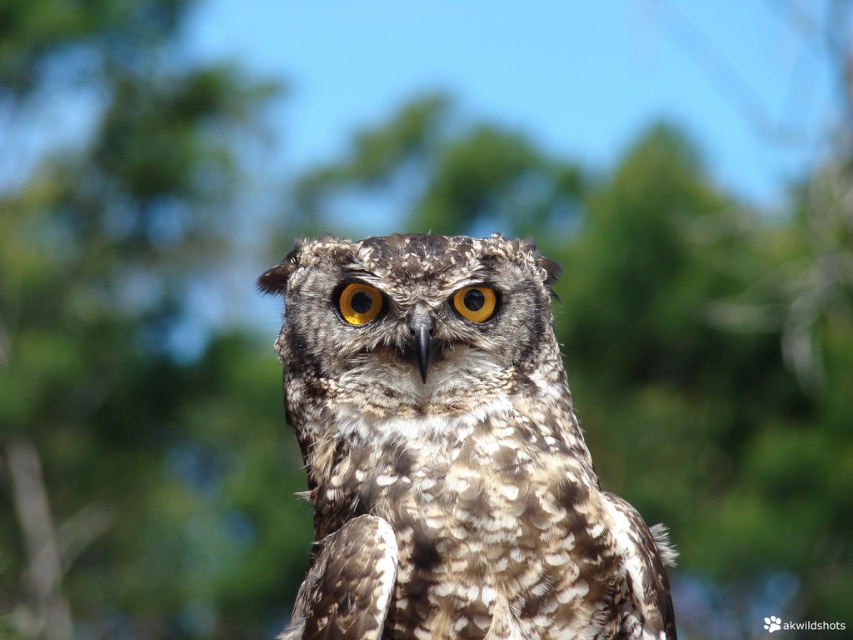
Question: Which point is farther to the camera?

Choices:
 (A) (367, 291)
 (B) (485, 502)

Answer: (A)

Question: Which object is closer to the camera taking this photo?

Choices:
 (A) speckled feathered owl at center
 (B) yellow matte eye at center

Answer: (A)

Question: Which of the following is the farthest from the observer?

Choices:
 (A) golden matte eye at center
 (B) speckled feathered owl at center

Answer: (A)

Question: Can you confirm if golden matte eye at center is positioned below yellow matte eye at center?

Choices:
 (A) yes
 (B) no

Answer: (B)

Question: Can you confirm if speckled feathered owl at center is positioned to the left of yellow matte eye at center?

Choices:
 (A) yes
 (B) no

Answer: (A)

Question: Can you confirm if speckled feathered owl at center is positioned to the left of golden matte eye at center?

Choices:
 (A) no
 (B) yes

Answer: (A)